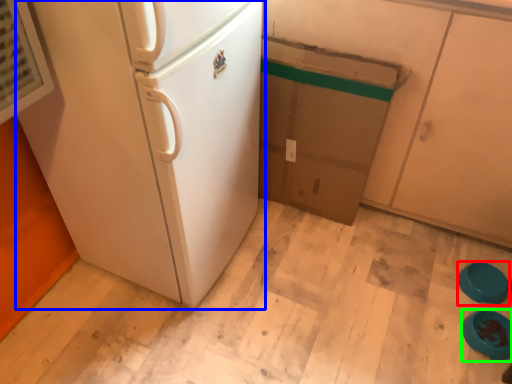
Question: Which is nearer to the appliance (highlighted by a red box)? refrigerator (highlighted by a blue box) or appliance (highlighted by a green box).

Choices:
 (A) refrigerator
 (B) appliance

Answer: (B)